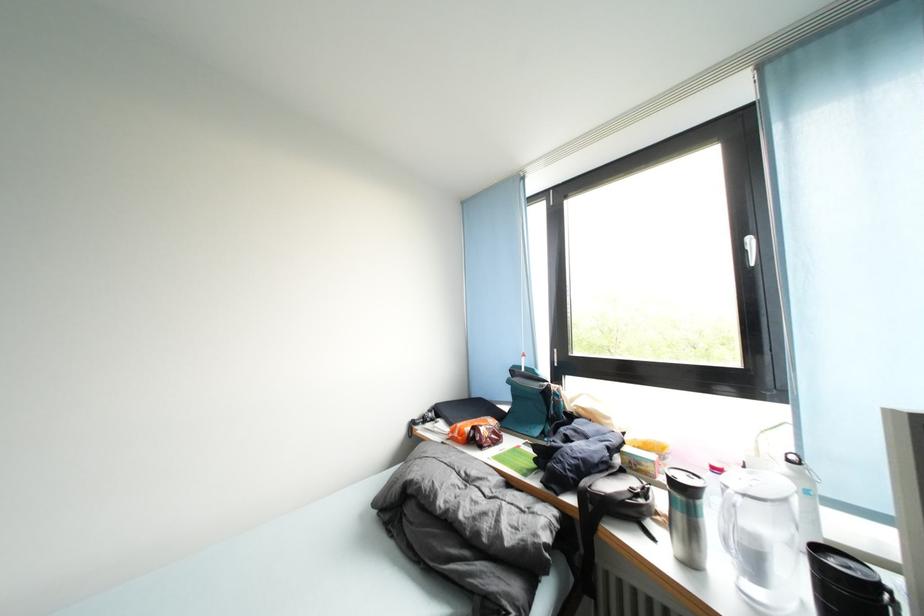
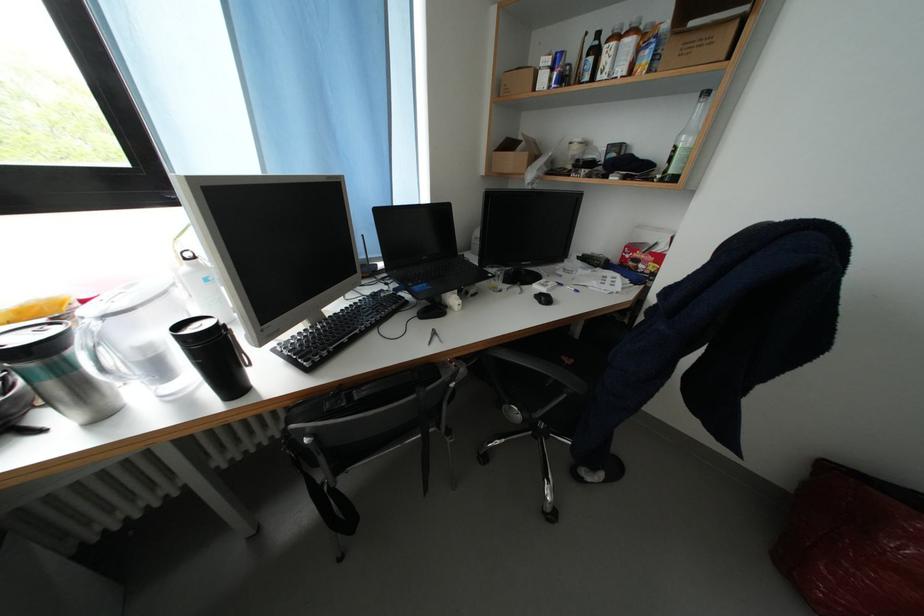
The point at (825, 552) is marked in the first image. Where is the corresponding point in the second image?

(188, 330)